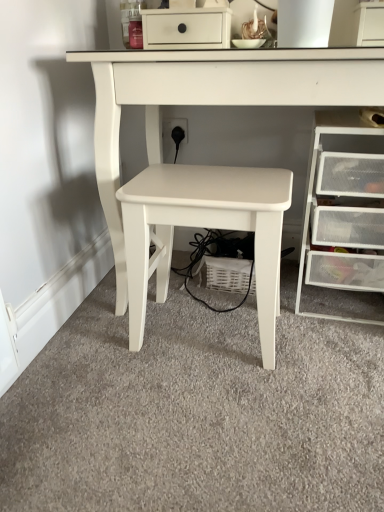
Where is `vacant space situated above white matte table at center, arranged as the 1th table when viewed from the left (from a real-world perspective)`? This screenshot has width=384, height=512. vacant space situated above white matte table at center, arranged as the 1th table when viewed from the left (from a real-world perspective) is located at coordinates (204, 181).